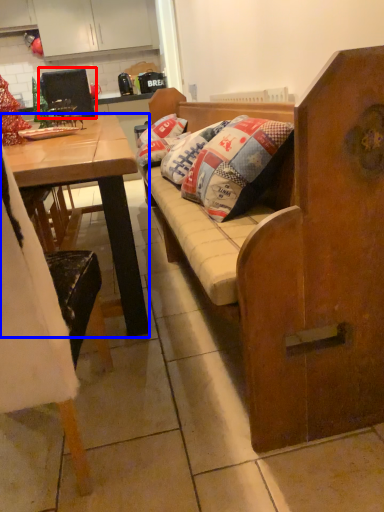
Question: Which object is closer to the camera taking this photo, armchair (highlighted by a red box) or desk (highlighted by a blue box)?

Choices:
 (A) armchair
 (B) desk

Answer: (B)